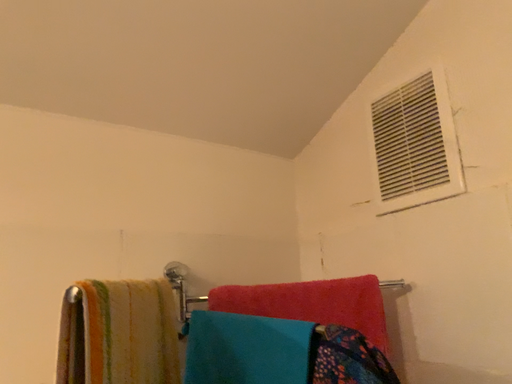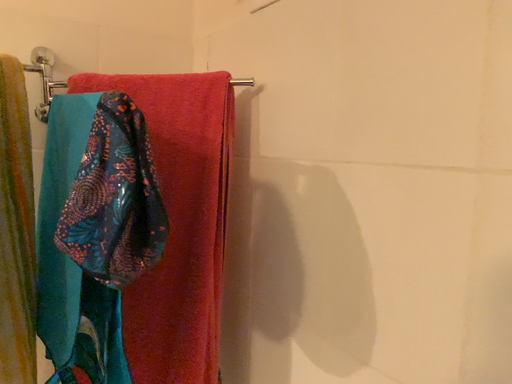
Question: Which way did the camera rotate in the video?

Choices:
 (A) rotated downward
 (B) rotated upward

Answer: (A)